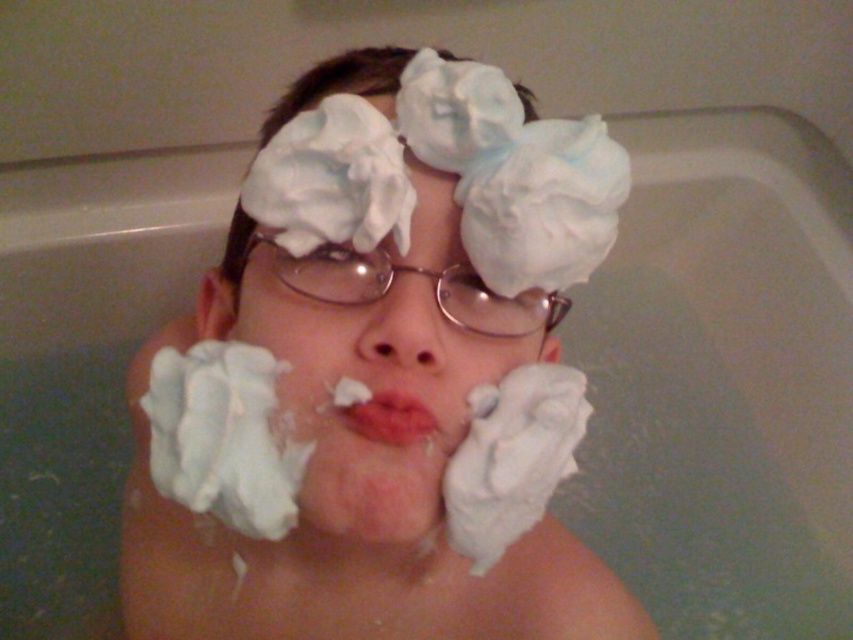
Does point (125, 497) come behind point (419, 356)?

Yes, it is behind point (419, 356).

Which is in front, point (122, 556) or point (440, 364)?

Positioned in front is point (440, 364).

Who is more distant from viewer, (509,572) or (402,337)?

Positioned behind is point (509,572).

Identify the location of white foamy shaving cream at center. The width and height of the screenshot is (853, 640). (352, 509).

The height and width of the screenshot is (640, 853). Find the location of `white fluffy frosting at lower left`. white fluffy frosting at lower left is located at coordinates (223, 436).

Between white fluffy frosting at lower left and smooth pink lips at center, which one appears on the right side from the viewer's perspective?

From the viewer's perspective, smooth pink lips at center appears more on the right side.

Locate an element on the screen. Image resolution: width=853 pixels, height=640 pixels. white fluffy frosting at lower left is located at coordinates (223, 436).

At what (x,y) coordinates should I click in order to perform the action: click on white fluffy frosting at lower left. Please return your answer as a coordinate pair (x, y). Looking at the image, I should click on (223, 436).

In the scene shown: Can you confirm if white foamy shaving cream at center is wider than smooth pink lips at center?

Yes.

Who is more forward, (370, 84) or (390, 413)?

Positioned in front is point (390, 413).

At what (x,y) coordinates should I click in order to perform the action: click on white foamy shaving cream at center. Please return your answer as a coordinate pair (x, y). The width and height of the screenshot is (853, 640). Looking at the image, I should click on (352, 509).